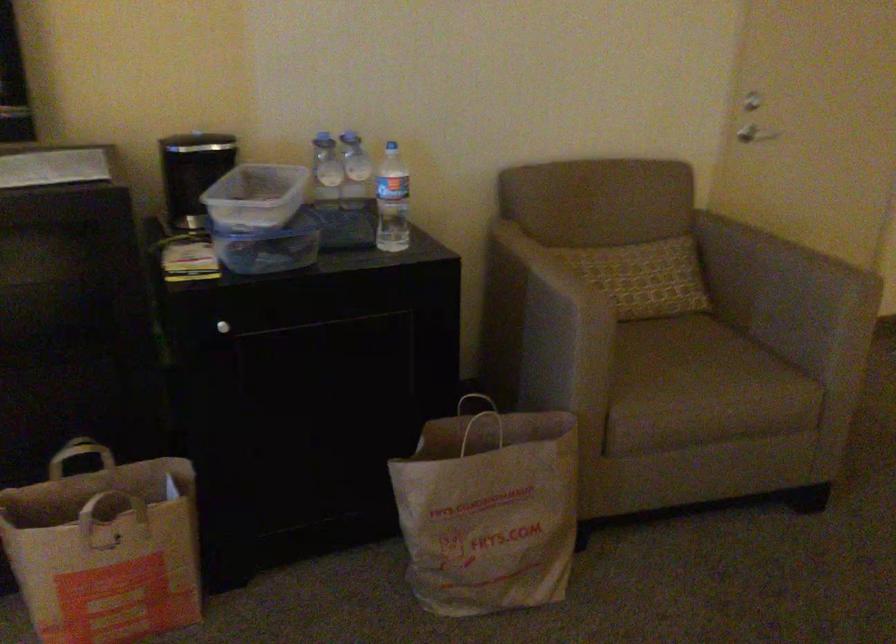
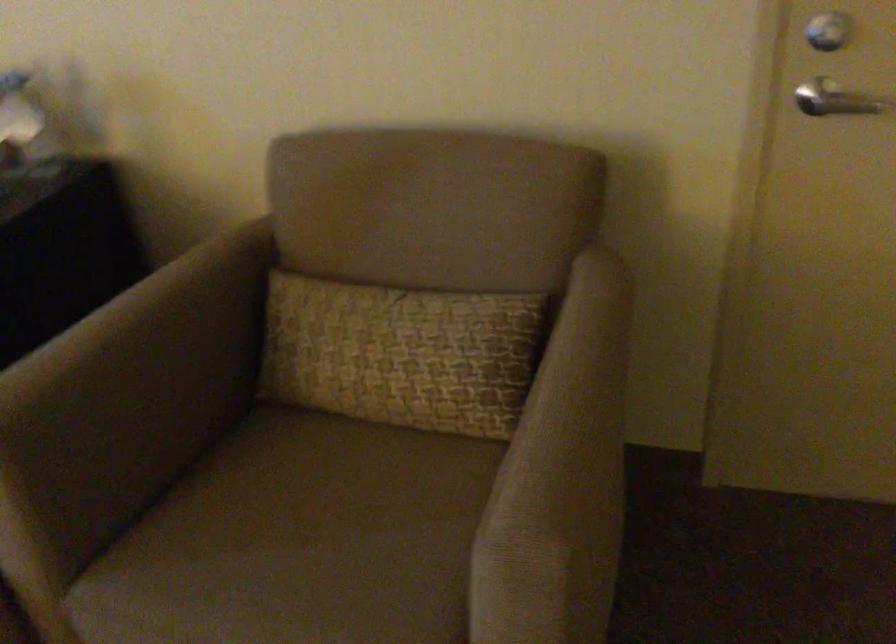
Locate, in the second image, the point that corresponds to (765,128) in the first image.

(840, 102)